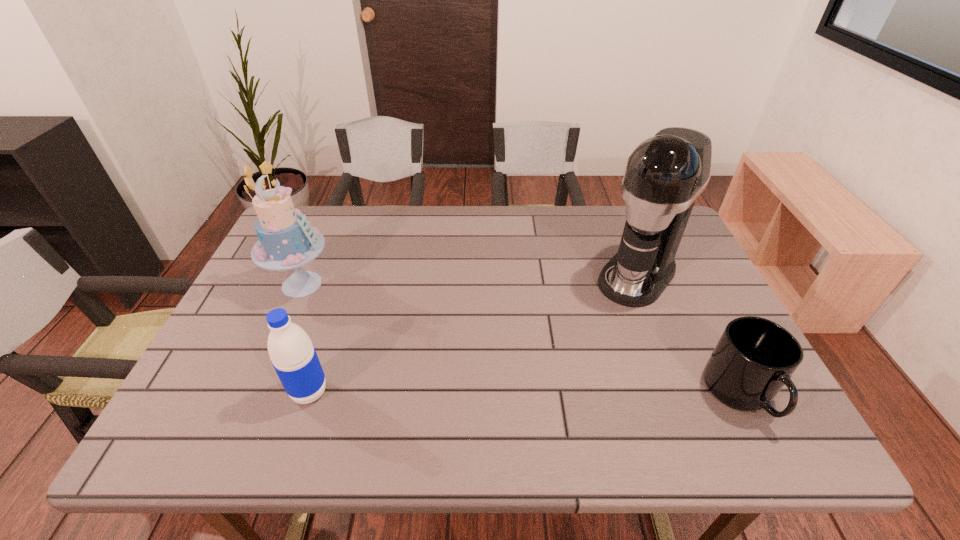
This screenshot has height=540, width=960. Find the location of `blank region between the water bottle and the shortest object`. blank region between the water bottle and the shortest object is located at coordinates (525, 393).

Identify the location of empty location between the coffee maker and the water bottle. The width and height of the screenshot is (960, 540). (473, 334).

At what (x,y) coordinates should I click in order to perform the action: click on empty space that is in between the mug and the second tallest object. Please return your answer as a coordinate pair (x, y). The height and width of the screenshot is (540, 960). Looking at the image, I should click on (521, 339).

This screenshot has height=540, width=960. What are the coordinates of `object that is the third closest to the mug` in the screenshot? It's located at (286, 241).

Locate an element on the screen. object that is the third closest to the cake is located at coordinates (754, 358).

Locate an element on the screen. The width and height of the screenshot is (960, 540). vacant area that satisfies the following two spatial constraints: 1. on the back side of the coffee maker; 2. on the left side of the second shortest object is located at coordinates (348, 276).

I want to click on vacant region that satisfies the following two spatial constraints: 1. on the front side of the cake; 2. on the right side of the third tallest object, so click(254, 392).